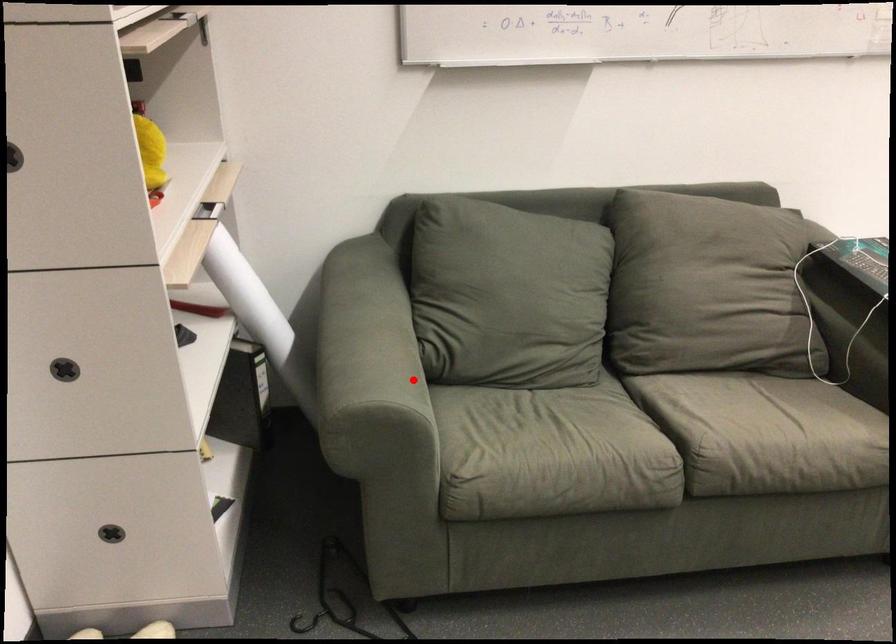
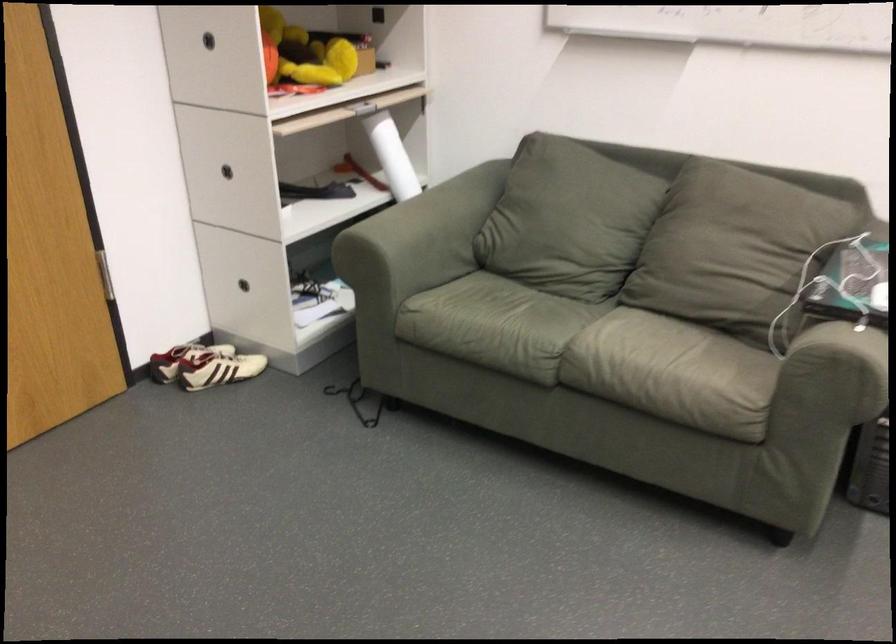
Question: I am providing you with two images of the same scene from different viewpoints. In image1, a red point is highlighted. Considering the same 3D point in image2, which of the following is correct?

Choices:
 (A) It is closer
 (B) It is farther

Answer: (B)